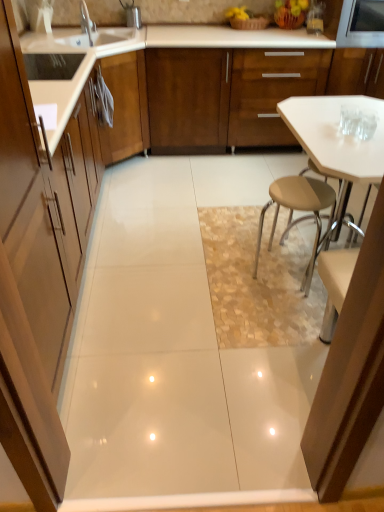
The height and width of the screenshot is (512, 384). Identify the location of blank space to the left of white glossy table at center. (212, 303).